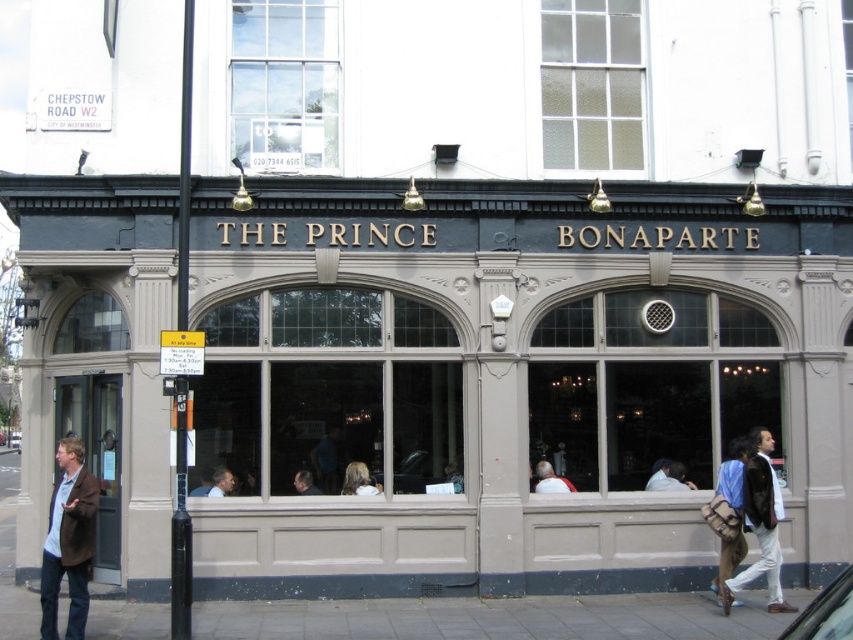
You are standing in front of The Prince Bonaparte building and want to take a photo. You notice two points marked on the building facade at coordinates point [761,611] and point [227,493]. Which point is closer to your current position?

Point [761,611] is closer to the viewer than point [227,493].

You are standing in front of The Prince Bonaparte building. You want to take a photo of the point at coordinates (57, 445). Is this point within the camera frame?

The point at coordinates (57, 445) is 13.24 meters away from the camera. Since the camera can typically capture objects within its field of view at that distance, the point is likely within the camera frame.

You are standing in front of The Prince Bonaparte restaurant and need to walk to the gray concrete sidewalk at lower center. What are the coordinates where you should head to?

The gray concrete sidewalk at lower center is located at coordinates point (489, 618).